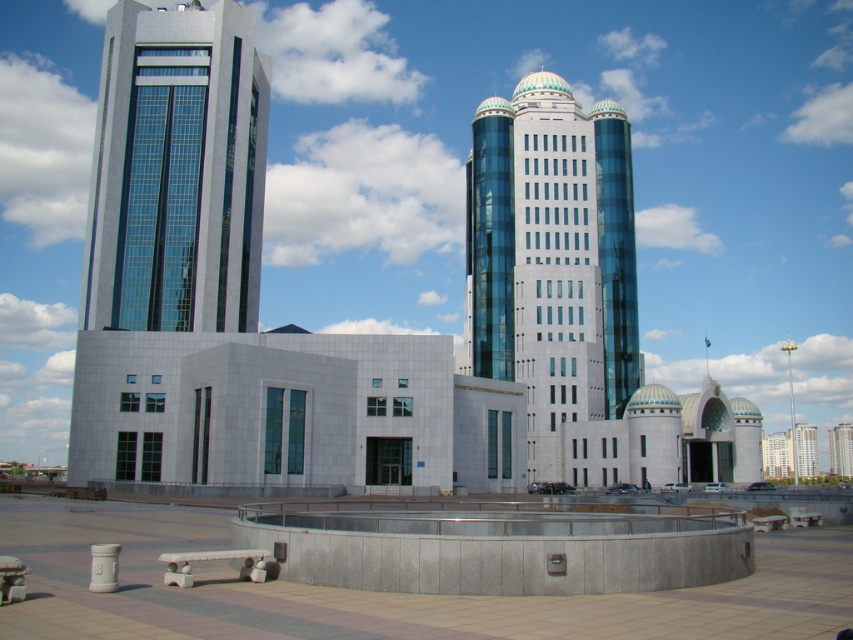
Question: Which of the following is the closest to the observer?

Choices:
 (A) (149, 275)
 (B) (584, 156)

Answer: (A)

Question: Is matte glass tower at left below glassy blue skyscraper at center?

Choices:
 (A) no
 (B) yes

Answer: (A)

Question: Which point is closer to the camera taking this photo?

Choices:
 (A) coord(575,364)
 (B) coord(206,42)

Answer: (A)

Question: Is matte glass tower at left positioned in front of glassy blue skyscraper at center?

Choices:
 (A) yes
 (B) no

Answer: (B)

Question: Which point is closer to the camera taking this photo?

Choices:
 (A) (541, 168)
 (B) (239, 323)

Answer: (B)

Question: Is matte glass tower at left behind glassy blue skyscraper at center?

Choices:
 (A) no
 (B) yes

Answer: (B)